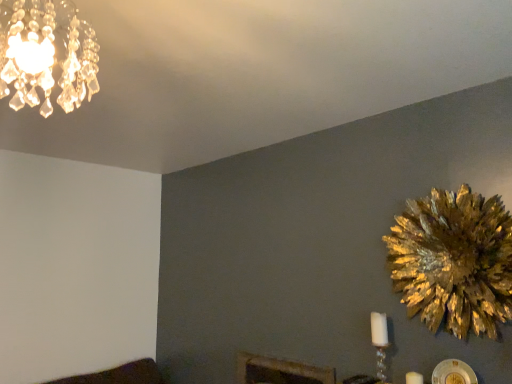
Question: From a real-world perspective, is crystal glass chandelier at upper left physically above white glass candle at lower right?

Choices:
 (A) no
 (B) yes

Answer: (B)

Question: Does crystal glass chandelier at upper left have a larger size compared to white glass candle at lower right?

Choices:
 (A) yes
 (B) no

Answer: (A)

Question: Is crystal glass chandelier at upper left facing away from white glass candle at lower right?

Choices:
 (A) yes
 (B) no

Answer: (B)

Question: From the image's perspective, is crystal glass chandelier at upper left beneath white glass candle at lower right?

Choices:
 (A) yes
 (B) no

Answer: (B)

Question: Could you tell me if crystal glass chandelier at upper left is facing white glass candle at lower right?

Choices:
 (A) no
 (B) yes

Answer: (A)

Question: Is white glass candle at lower right wider or thinner than gold metallic flower at right?

Choices:
 (A) thin
 (B) wide

Answer: (A)

Question: Is point (378, 355) closer or farther from the camera than point (508, 314)?

Choices:
 (A) farther
 (B) closer

Answer: (A)

Question: Considering their positions, is white glass candle at lower right located in front of or behind gold metallic flower at right?

Choices:
 (A) behind
 (B) front

Answer: (A)

Question: Based on their positions, is white glass candle at lower right located to the left or right of gold metallic flower at right?

Choices:
 (A) left
 (B) right

Answer: (A)

Question: Is crystal glass chandelier at upper left situated inside gold metallic flower at right or outside?

Choices:
 (A) outside
 (B) inside

Answer: (A)

Question: Looking at their shapes, would you say crystal glass chandelier at upper left is wider or thinner than gold metallic flower at right?

Choices:
 (A) thin
 (B) wide

Answer: (B)

Question: Considering the positions of point (31, 79) and point (470, 322), is point (31, 79) closer or farther from the camera than point (470, 322)?

Choices:
 (A) closer
 (B) farther

Answer: (A)

Question: From the image's perspective, is crystal glass chandelier at upper left above or below gold metallic flower at right?

Choices:
 (A) above
 (B) below

Answer: (A)

Question: Looking at their shapes, would you say crystal glass chandelier at upper left is wider or thinner than white glass candle at lower right?

Choices:
 (A) thin
 (B) wide

Answer: (B)

Question: From their relative heights in the image, would you say crystal glass chandelier at upper left is taller or shorter than white glass candle at lower right?

Choices:
 (A) tall
 (B) short

Answer: (B)